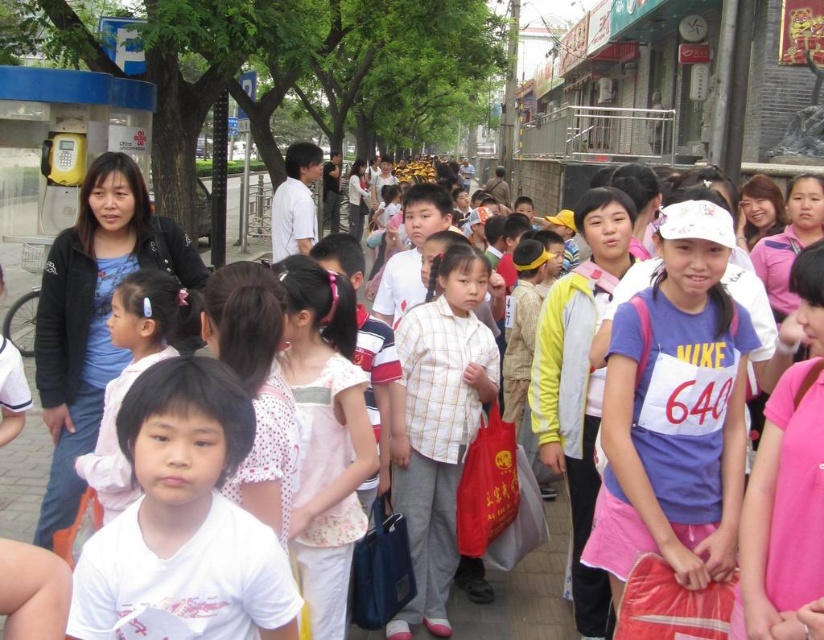
Between purple cotton shirt at center and pink fabric hairband at center, which one has more height?

With more height is purple cotton shirt at center.

Does point (710, 436) come in front of point (118, 289)?

Yes, point (710, 436) is closer to viewer.

You are a GUI agent. You are given a task and a screenshot of the screen. Output one action in this format:
    pyautogui.click(x=<x>, y=<y>)
    Task: Click on the purple cotton shirt at center
    The image size is (824, 640).
    Given the screenshot: What is the action you would take?
    (675, 410)

Does plaid cotton shirt at center come behind white dotted shirt at center?

Yes, plaid cotton shirt at center is behind white dotted shirt at center.

Between plaid cotton shirt at center and white dotted shirt at center, which one is positioned lower?

plaid cotton shirt at center is below.

Does point (466, 268) lie in front of point (319, 268)?

No, (466, 268) is further to viewer.

Where is `plaid cotton shirt at center`? The height and width of the screenshot is (640, 824). plaid cotton shirt at center is located at coordinates (438, 424).

Consider the image. Measure the distance between point (x=616, y=417) and camera.

Point (x=616, y=417) and camera are 29.83 meters apart.

Is purple cotton shirt at center to the left of plaid cotton shirt at center from the viewer's perspective?

No, purple cotton shirt at center is not to the left of plaid cotton shirt at center.

Is point (701, 502) positioned after point (489, 353)?

No, (701, 502) is in front of (489, 353).

Identify the location of purple cotton shirt at center. The height and width of the screenshot is (640, 824). (675, 410).